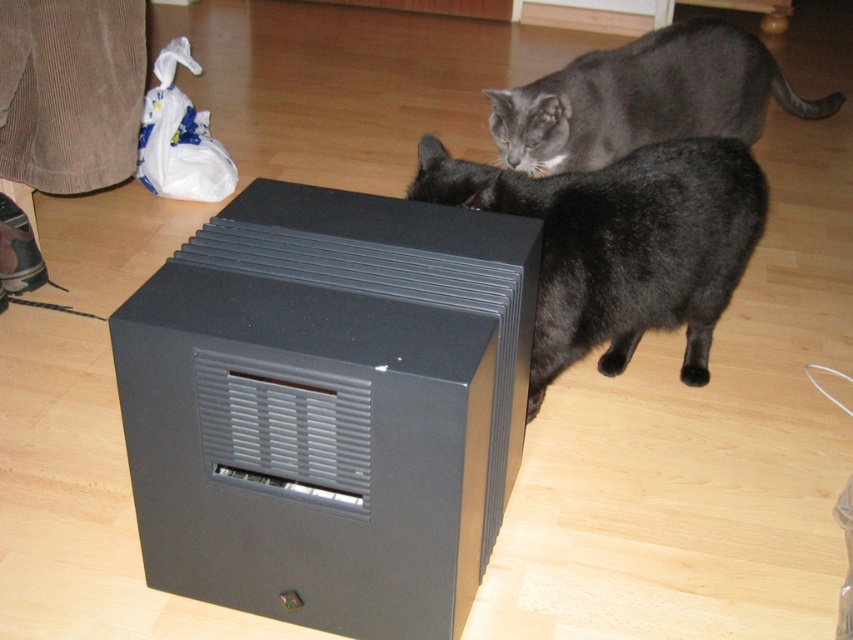
Is matte black box at center taller than black matte/black fur cat at right?

Yes, matte black box at center is taller than black matte/black fur cat at right.

Who is more forward, (248, 470) or (685, 305)?

Point (248, 470) is in front.

Between point (440, 492) and point (685, 378), which one is positioned behind?

Point (685, 378)

This screenshot has height=640, width=853. I want to click on matte black box at center, so click(x=328, y=406).

Which is above, black matte/black fur cat at right or gray fur cat at upper center?

gray fur cat at upper center is higher up.

What do you see at coordinates (621, 244) in the screenshot? Image resolution: width=853 pixels, height=640 pixels. I see `black matte/black fur cat at right` at bounding box center [621, 244].

Where is `black matte/black fur cat at right`? The image size is (853, 640). black matte/black fur cat at right is located at coordinates (621, 244).

Is point (175, 516) less distant than point (711, 68)?

Yes.

Can you confirm if matte black box at center is positioned above gray fur cat at upper center?

Actually, matte black box at center is below gray fur cat at upper center.

Between point (154, 424) and point (645, 131), which one is positioned in front?

Positioned in front is point (154, 424).

The width and height of the screenshot is (853, 640). I want to click on matte black box at center, so click(x=328, y=406).